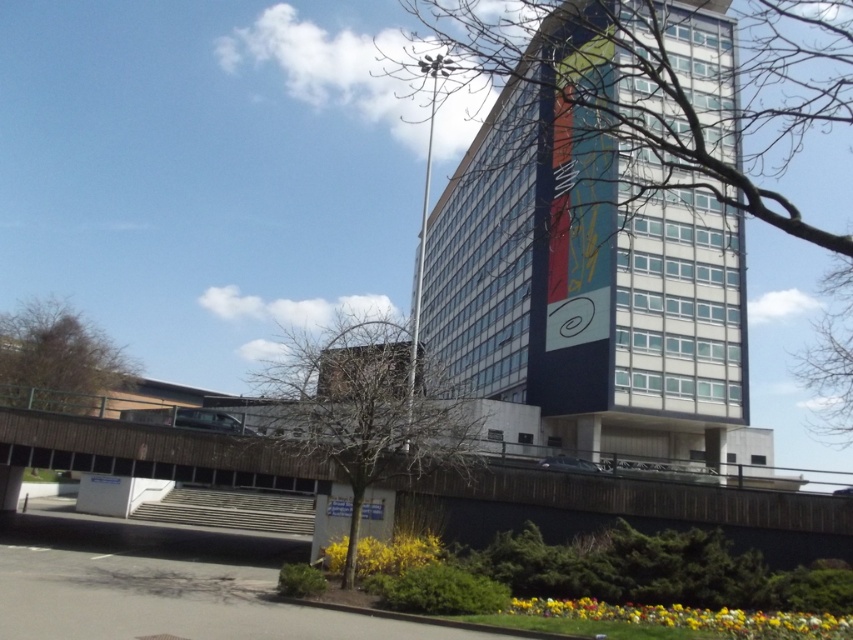
Based on the photo, which of these two, bare branches at upper right or brown textured tree at lower left, stands taller?

With more height is bare branches at upper right.

The image size is (853, 640). What are the coordinates of `bare branches at upper right` in the screenshot? It's located at (602, 209).

Between point (549, 419) and point (85, 387), which one is positioned behind?

The point (85, 387) is more distant.

Find the location of a particular element. bare branches at upper right is located at coordinates (602, 209).

Who is positioned more to the right, bare branches at upper right or bare branches at center?

bare branches at upper right

Is bare branches at upper right closer to the viewer compared to bare branches at center?

Yes, bare branches at upper right is closer to the viewer.

Where is `bare branches at upper right`? bare branches at upper right is located at coordinates pyautogui.click(x=602, y=209).

The width and height of the screenshot is (853, 640). I want to click on bare branches at upper right, so click(602, 209).

Who is positioned more to the left, bare branches at center or brown textured tree at lower left?

brown textured tree at lower left

Who is shorter, bare branches at center or brown textured tree at lower left?

With less height is brown textured tree at lower left.

The height and width of the screenshot is (640, 853). Find the location of `bare branches at center`. bare branches at center is located at coordinates (370, 410).